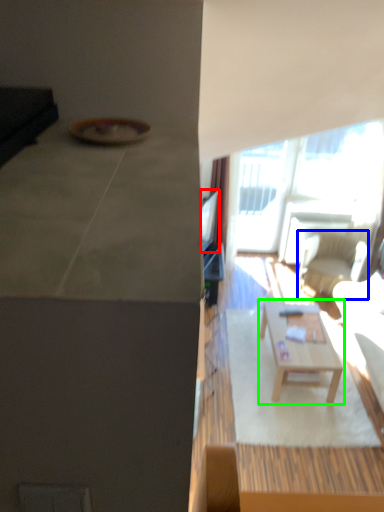
Question: Considering the real-world distances, which object is farthest from television (highlighted by a red box)? chair (highlighted by a blue box) or coffee table (highlighted by a green box)?

Choices:
 (A) chair
 (B) coffee table

Answer: (A)